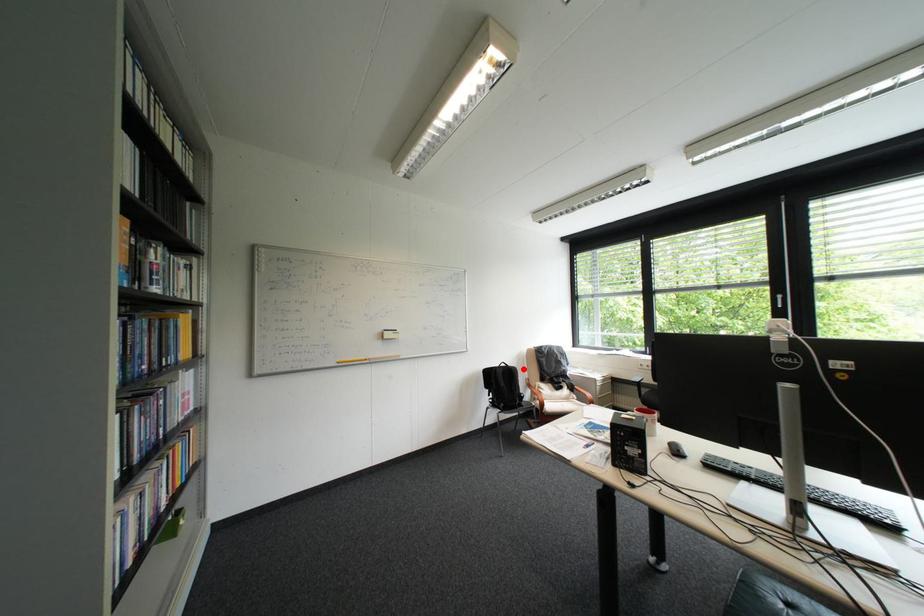
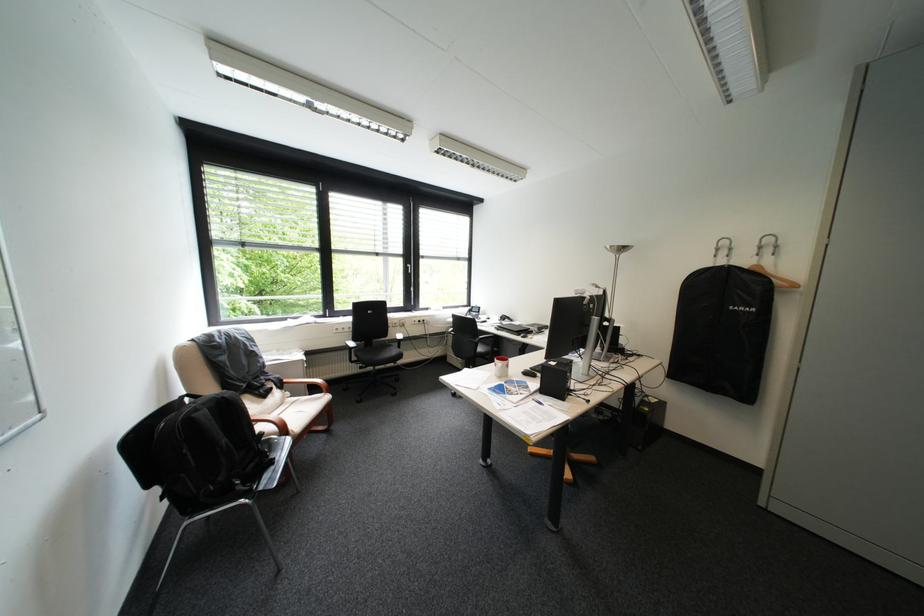
Where in the second image is the point corresponding to the highlighted location from the first image?

(236, 398)